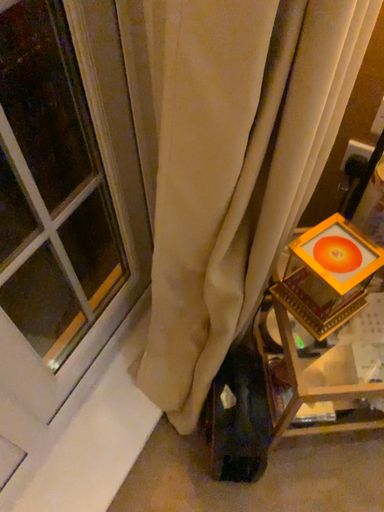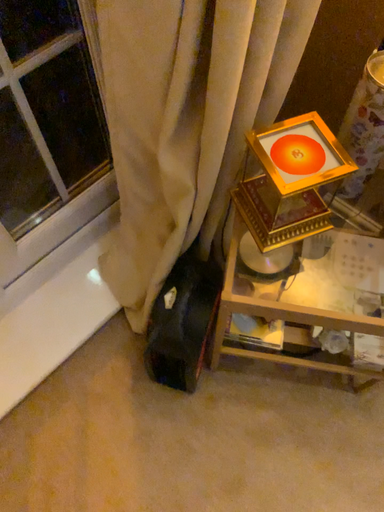
Question: How did the camera likely rotate when shooting the video?

Choices:
 (A) rotated right
 (B) rotated left

Answer: (B)